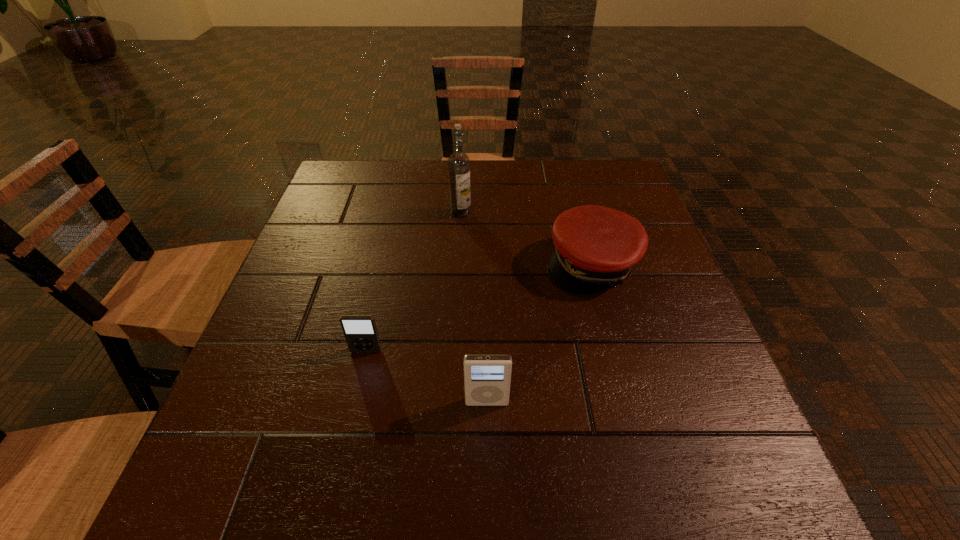
I want to click on free space between the rightmost object and the taller iPod, so (x=540, y=333).

You are a GUI agent. You are given a task and a screenshot of the screen. Output one action in this format:
    pyautogui.click(x=<x>, y=<y>)
    Task: Click on the free space between the vodka and the third shortest object
    
    Given the screenshot: What is the action you would take?
    pos(474,308)

At what (x,y) coordinates should I click in order to perform the action: click on unoccupied area between the third nearest object and the shorter iPod. Please return your answer as a coordinate pair (x, y). This screenshot has width=960, height=540. Looking at the image, I should click on (479, 307).

Where is `blank region between the leftmost object and the farthest object`? This screenshot has height=540, width=960. blank region between the leftmost object and the farthest object is located at coordinates (414, 282).

You are a GUI agent. You are given a task and a screenshot of the screen. Output one action in this format:
    pyautogui.click(x=<x>, y=<y>)
    Task: Click on the vacant region between the farther iPod and the right iPod
    
    Given the screenshot: What is the action you would take?
    pyautogui.click(x=426, y=377)

Where is `vacant space that's between the nearest object and the cap`? The image size is (960, 540). vacant space that's between the nearest object and the cap is located at coordinates [x=540, y=333].

This screenshot has height=540, width=960. Find the location of `vacant point located between the cap and the second nearest object`. vacant point located between the cap and the second nearest object is located at coordinates (479, 307).

Where is `vacant area that lies between the farthest object and the farther iPod`? This screenshot has height=540, width=960. vacant area that lies between the farthest object and the farther iPod is located at coordinates (414, 282).

Where is `vacant area between the vodka and the taller iPod`? The height and width of the screenshot is (540, 960). vacant area between the vodka and the taller iPod is located at coordinates (474, 308).

The width and height of the screenshot is (960, 540). In order to click on unoccupied area between the left iPod and the right iPod in this screenshot , I will do (x=426, y=377).